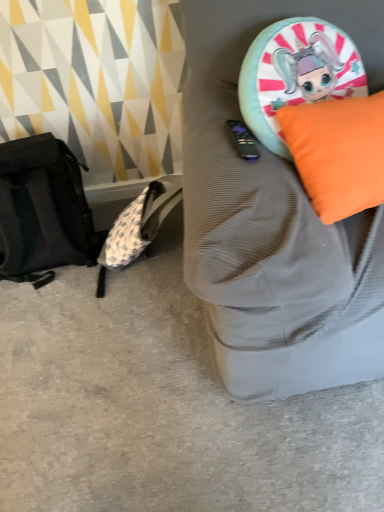
You are a GUI agent. You are given a task and a screenshot of the screen. Output one action in this format:
    pyautogui.click(x=<x>, y=<y>)
    Task: Click on the orange fabric cushion at upper right
    
    Given the screenshot: What is the action you would take?
    pyautogui.click(x=274, y=222)

What's the angular difference between black fabric messenger bag at left and orange fabric cushion at upper right's facing directions?

The angular difference between black fabric messenger bag at left and orange fabric cushion at upper right is 1.12 degrees.

From a real-world perspective, is black fabric messenger bag at left physically located above or below orange fabric cushion at upper right?

black fabric messenger bag at left is situated lower than orange fabric cushion at upper right in the real world.

Looking at this image, from the image's perspective, between black fabric messenger bag at left and orange fabric cushion at upper right, which one is located above?

orange fabric cushion at upper right.

Measure the distance from black fabric messenger bag at left to orange fabric cushion at upper right.

black fabric messenger bag at left is 25.66 inches away from orange fabric cushion at upper right.

Is black fabric backpack at left located outside orange fabric pillow at upper right?

black fabric backpack at left is positioned outside orange fabric pillow at upper right.

From the image's perspective, is black fabric backpack at left located above or below orange fabric pillow at upper right?

Clearly, from the image's perspective, black fabric backpack at left is below orange fabric pillow at upper right.

Does black fabric backpack at left have a smaller size compared to orange fabric pillow at upper right?

Actually, black fabric backpack at left might be larger than orange fabric pillow at upper right.

Which is in front, point (288, 448) or point (331, 167)?

Positioned in front is point (331, 167).

Can you confirm if orange fabric pillow at upper right is positioned to the right of orange fabric cushion at upper right?

No, orange fabric pillow at upper right is not to the right of orange fabric cushion at upper right.

Is point (354, 152) positioned before point (343, 327)?

Yes, it is in front of point (343, 327).

Considering the relative sizes of orange fabric pillow at upper right and orange fabric cushion at upper right in the image provided, is orange fabric pillow at upper right taller than orange fabric cushion at upper right?

In fact, orange fabric pillow at upper right may be shorter than orange fabric cushion at upper right.

Relative to orange fabric cushion at upper right, is orange fabric pillow at upper right in front or behind?

orange fabric pillow at upper right is positioned farther from the viewer than orange fabric cushion at upper right.

Is orange fabric cushion at upper right bigger than orange fabric pillow at upper right?

Indeed, orange fabric cushion at upper right has a larger size compared to orange fabric pillow at upper right.

Are orange fabric cushion at upper right and orange fabric pillow at upper right located far from each other?

orange fabric cushion at upper right is near orange fabric pillow at upper right, not far away.

From the picture: Is orange fabric cushion at upper right positioned beyond the bounds of orange fabric pillow at upper right?

Yes, orange fabric cushion at upper right is outside of orange fabric pillow at upper right.

Who is taller, orange fabric cushion at upper right or orange fabric pillow at upper right?

orange fabric cushion at upper right.

Which object is closer to the camera taking this photo, orange fabric pillow at upper right or black fabric messenger bag at left?

orange fabric pillow at upper right is in front.

Are orange fabric pillow at upper right and black fabric messenger bag at left far apart?

No, there isn't a large distance between orange fabric pillow at upper right and black fabric messenger bag at left.

The height and width of the screenshot is (512, 384). What are the coordinates of `pillow located on the right of black fabric messenger bag at left` in the screenshot? It's located at [338, 153].

Does orange fabric pillow at upper right turn towards black fabric messenger bag at left?

No, orange fabric pillow at upper right is not aimed at black fabric messenger bag at left.

From a real-world perspective, does black fabric messenger bag at left stand above orange fabric pillow at upper right?

Actually, black fabric messenger bag at left is physically below orange fabric pillow at upper right in the real world.

Between black fabric messenger bag at left and orange fabric pillow at upper right, which one has larger size?

With larger size is black fabric messenger bag at left.

Is black fabric messenger bag at left thinner than orange fabric pillow at upper right?

No, black fabric messenger bag at left is not thinner than orange fabric pillow at upper right.

Does point (0, 230) lie behind point (341, 192)?

Yes, it is behind point (341, 192).

Considering the sizes of objects black fabric backpack at left and orange fabric cushion at upper right in the image provided, who is bigger, black fabric backpack at left or orange fabric cushion at upper right?

With larger size is orange fabric cushion at upper right.

Is black fabric backpack at left oriented away from orange fabric cushion at upper right?

No, orange fabric cushion at upper right is not at the back of black fabric backpack at left.

Which object is further away from the camera, black fabric backpack at left or orange fabric cushion at upper right?

black fabric backpack at left.

Is black fabric backpack at left touching orange fabric cushion at upper right?

No, black fabric backpack at left is not in contact with orange fabric cushion at upper right.

This screenshot has height=512, width=384. Find the location of `furniture lying above the black fabric messenger bag at left (from the image's perspective)`. furniture lying above the black fabric messenger bag at left (from the image's perspective) is located at coordinates (274, 222).

Locate an element on the screen. The image size is (384, 512). pillow in front of the black fabric backpack at left is located at coordinates (338, 153).

Based on their spatial positions, is black fabric backpack at left or orange fabric cushion at upper right closer to black fabric messenger bag at left?

Based on the image, black fabric backpack at left appears to be nearer to black fabric messenger bag at left.

When comparing their distances from orange fabric pillow at upper right, does black fabric messenger bag at left or black fabric backpack at left seem further?

The object further to orange fabric pillow at upper right is black fabric messenger bag at left.

Looking at the image, which one is located closer to orange fabric pillow at upper right, black fabric backpack at left or orange fabric cushion at upper right?

The object closer to orange fabric pillow at upper right is orange fabric cushion at upper right.

Estimate the real-world distances between objects in this image. Which object is closer to orange fabric cushion at upper right, orange fabric pillow at upper right or black fabric backpack at left?

Based on the image, orange fabric pillow at upper right appears to be nearer to orange fabric cushion at upper right.

Looking at the image, which one is located further to black fabric backpack at left, orange fabric pillow at upper right or black fabric messenger bag at left?

Among the two, orange fabric pillow at upper right is located further to black fabric backpack at left.

Based on their spatial positions, is black fabric messenger bag at left or orange fabric pillow at upper right closer to black fabric backpack at left?

black fabric messenger bag at left is positioned closer to the anchor black fabric backpack at left.

Estimate the real-world distances between objects in this image. Which object is closer to orange fabric cushion at upper right, black fabric messenger bag at left or black fabric backpack at left?

black fabric backpack at left is positioned closer to the anchor orange fabric cushion at upper right.

Estimate the real-world distances between objects in this image. Which object is closer to black fabric backpack at left, orange fabric cushion at upper right or black fabric messenger bag at left?

orange fabric cushion at upper right is positioned closer to the anchor black fabric backpack at left.

The height and width of the screenshot is (512, 384). Find the location of `pillow between black fabric messenger bag at left and orange fabric cushion at upper right`. pillow between black fabric messenger bag at left and orange fabric cushion at upper right is located at coordinates (338, 153).

Find the location of a particular element. The image size is (384, 512). concrete between black fabric messenger bag at left and orange fabric pillow at upper right in the horizontal direction is located at coordinates (162, 409).

Where is `concrete between black fabric messenger bag at left and orange fabric cushion at upper right`? concrete between black fabric messenger bag at left and orange fabric cushion at upper right is located at coordinates (162, 409).

The width and height of the screenshot is (384, 512). I want to click on pillow between orange fabric cushion at upper right and black fabric backpack at left in the front-back direction, so tap(338, 153).